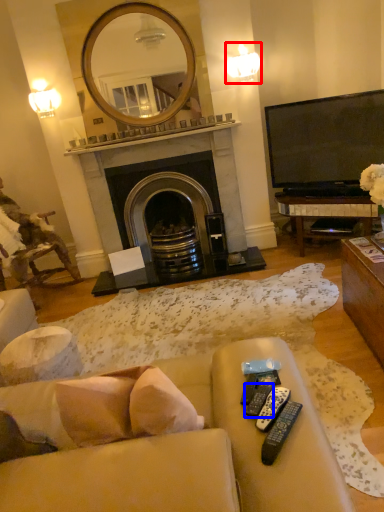
Question: Which of the following is the farthest to the observer, light fixture (highlighted by a red box) or remote control (highlighted by a blue box)?

Choices:
 (A) light fixture
 (B) remote control

Answer: (A)